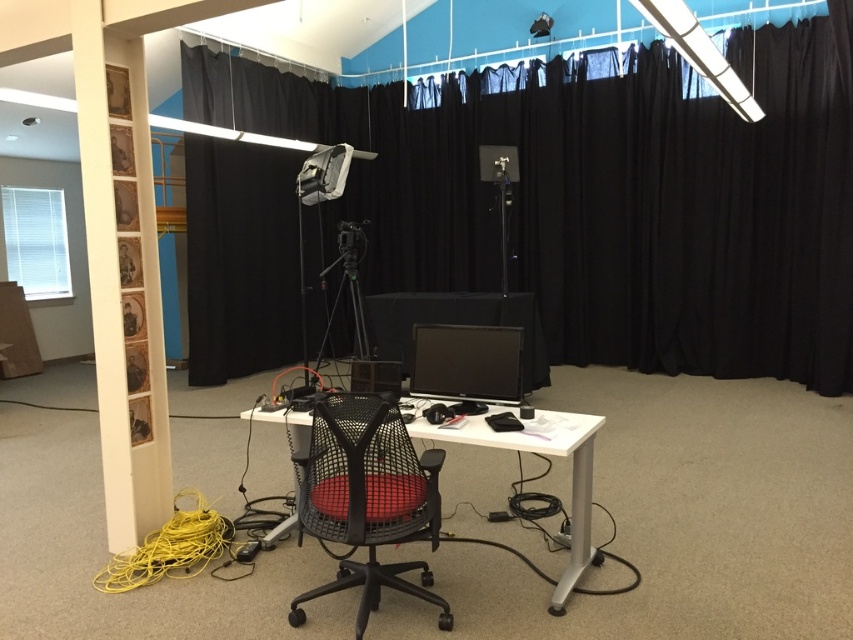
The width and height of the screenshot is (853, 640). Find the location of `mesh black swivel chair at center`. mesh black swivel chair at center is located at coordinates (367, 499).

Is black fabric curtain at center to the right of mesh black swivel chair at center from the viewer's perspective?

Indeed, black fabric curtain at center is positioned on the right side of mesh black swivel chair at center.

Can you confirm if black fabric curtain at center is taller than mesh black swivel chair at center?

Indeed, black fabric curtain at center has a greater height compared to mesh black swivel chair at center.

Between point (700, 188) and point (409, 509), which one is positioned in front?

Point (409, 509)

This screenshot has width=853, height=640. Identify the location of black fabric curtain at center. (606, 202).

Is black fabric curtain at center smaller than white plastic computer desk at center?

Yes.

Measure the distance between point (759, 346) and camera.

Point (759, 346) is 21.70 feet from camera.

The height and width of the screenshot is (640, 853). What are the coordinates of `black fabric curtain at center` in the screenshot? It's located at (606, 202).